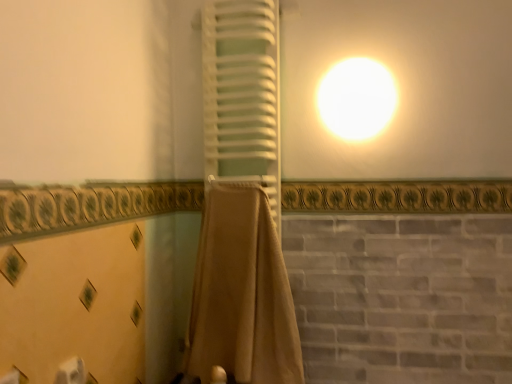
Question: Considering the relative sizes of white matte toilet paper at lower left and beige fabric towel at center, which ranks as the second curtain in top-to-bottom order, in the image provided, is white matte toilet paper at lower left thinner than beige fabric towel at center, which ranks as the second curtain in top-to-bottom order,?

Choices:
 (A) no
 (B) yes

Answer: (B)

Question: Can you confirm if white matte toilet paper at lower left is bigger than beige fabric towel at center, which ranks as the second curtain in top-to-bottom order?

Choices:
 (A) yes
 (B) no

Answer: (B)

Question: Is white matte toilet paper at lower left positioned before beige fabric towel at center, which is the first curtain from bottom to top?

Choices:
 (A) yes
 (B) no

Answer: (A)

Question: From the image's perspective, does white matte toilet paper at lower left appear lower than beige fabric towel at center, which ranks as the second curtain in top-to-bottom order?

Choices:
 (A) yes
 (B) no

Answer: (A)

Question: Can you confirm if white matte toilet paper at lower left is shorter than beige fabric towel at center, which ranks as the second curtain in top-to-bottom order?

Choices:
 (A) yes
 (B) no

Answer: (A)

Question: In terms of width, does white matte toilet paper at lower left look wider or thinner when compared to beige fabric towel at center, which ranks as the second curtain in top-to-bottom order?

Choices:
 (A) thin
 (B) wide

Answer: (A)

Question: Considering the positions of white matte toilet paper at lower left and beige fabric towel at center, which is the first curtain from bottom to top, in the image, is white matte toilet paper at lower left taller or shorter than beige fabric towel at center, which is the first curtain from bottom to top,?

Choices:
 (A) tall
 (B) short

Answer: (B)

Question: Is white matte toilet paper at lower left spatially inside beige fabric towel at center, which is the first curtain from bottom to top, or outside of it?

Choices:
 (A) inside
 (B) outside

Answer: (B)

Question: Is point (59, 377) positioned closer to the camera than point (292, 314)?

Choices:
 (A) closer
 (B) farther

Answer: (A)

Question: From the image's perspective, is beige fabric towel at center, which is the first curtain from bottom to top, positioned above or below white matte toilet paper at lower left?

Choices:
 (A) below
 (B) above

Answer: (B)

Question: Considering the positions of point (247, 205) and point (65, 380), is point (247, 205) closer or farther from the camera than point (65, 380)?

Choices:
 (A) closer
 (B) farther

Answer: (B)

Question: In terms of size, does beige fabric towel at center, which ranks as the second curtain in top-to-bottom order, appear bigger or smaller than white matte toilet paper at lower left?

Choices:
 (A) big
 (B) small

Answer: (A)

Question: In terms of height, does beige fabric towel at center, which ranks as the second curtain in top-to-bottom order, look taller or shorter compared to white matte toilet paper at lower left?

Choices:
 (A) tall
 (B) short

Answer: (A)

Question: Looking at the image, does beige fabric towel at center, which ranks as the second curtain in top-to-bottom order, seem bigger or smaller compared to white matte towel at center, the 2th curtain positioned from the bottom?

Choices:
 (A) small
 (B) big

Answer: (B)

Question: In terms of width, does beige fabric towel at center, which is the first curtain from bottom to top, look wider or thinner when compared to white matte towel at center, the 2th curtain positioned from the bottom?

Choices:
 (A) thin
 (B) wide

Answer: (B)